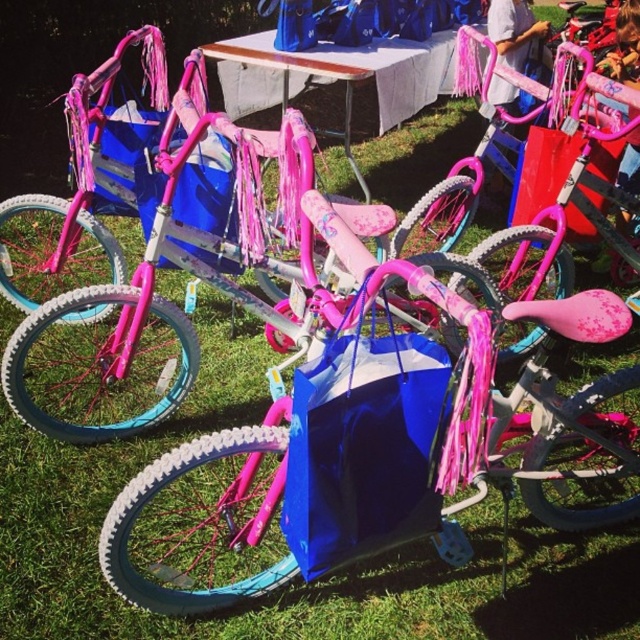
Based on the photo, which is below, blue glossy bag at center or white plastic picnic table at center?

blue glossy bag at center is below.

Is blue glossy bag at center positioned behind white plastic picnic table at center?

No, it is not.

Find the location of a particular element. blue glossy bag at center is located at coordinates (374, 458).

What are the coordinates of `blue glossy bag at center` in the screenshot? It's located at (374, 458).